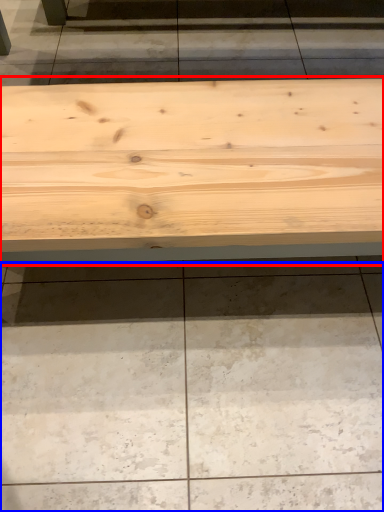
Question: Among these objects, which one is nearest to the camera, table (highlighted by a red box) or concrete (highlighted by a blue box)?

Choices:
 (A) table
 (B) concrete

Answer: (A)